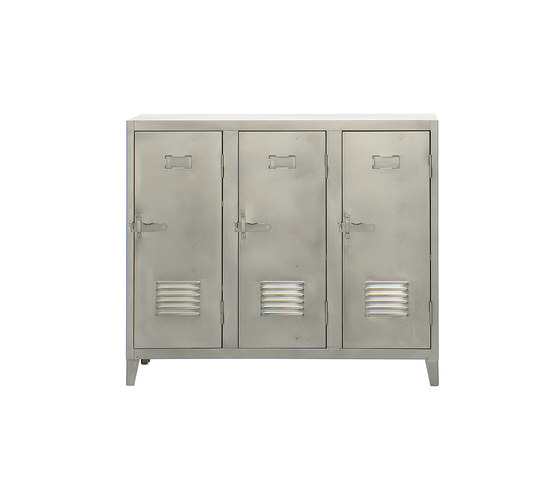
The image size is (560, 478). In order to click on wardrobe in this screenshot , I will do `click(277, 144)`.